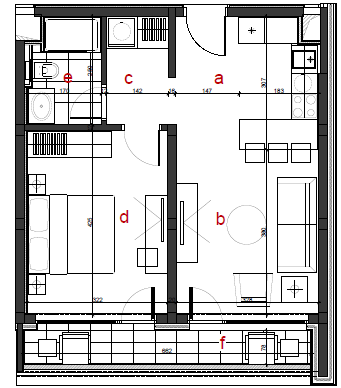
Identify the location of table. The image size is (341, 388). (249, 220), (275, 129), (297, 288).